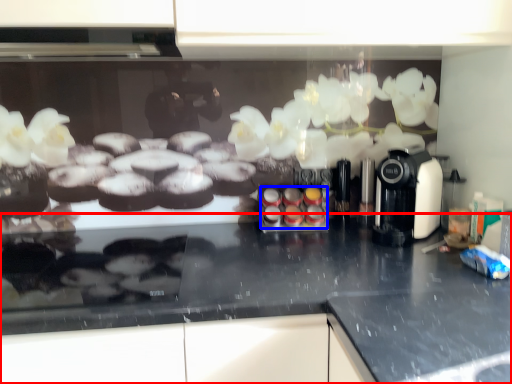
Question: Which object appears closest to the camera in this image, countertop (highlighted by a red box) or food (highlighted by a blue box)?

Choices:
 (A) countertop
 (B) food

Answer: (A)